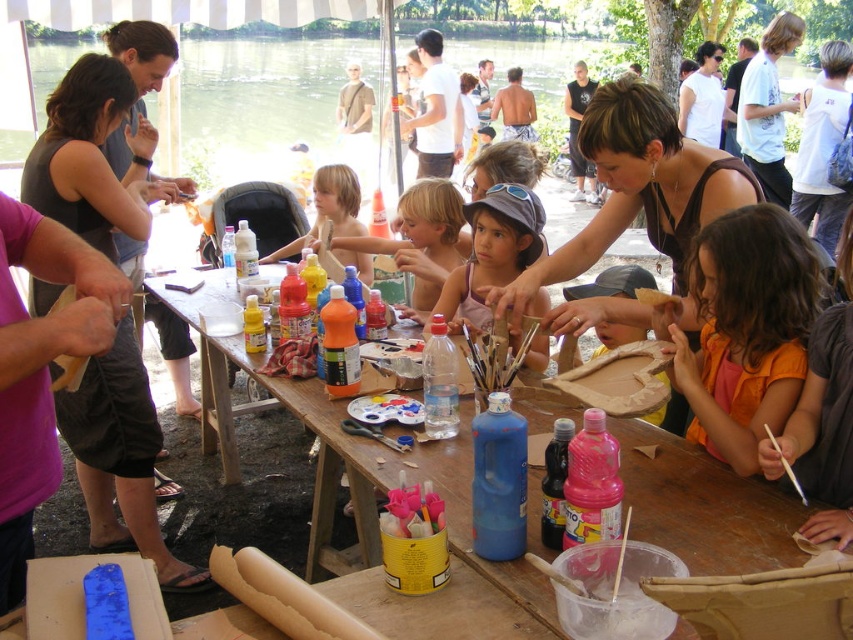
You are standing at the edge of the water and want to reach the wooden table at center to grab some paint. However, there is a person wearing a matte brown tank top at center blocking your path. According to the scene description, which direction should you move to go around them and reach the table?

Since the wooden table at center is to the left of the matte brown tank top at center, you should move to the left side of the person wearing the matte brown tank top at center to reach the wooden table at center.

You are a photographer trying to capture a candid shot of the pink fabric shirt at center and the blonde hair child at center. Based on their heights, which one should you focus on first to ensure both are in frame without needing to adjust your camera angle?

The pink fabric shirt at center has a lesser height compared to the blonde hair child at center, so you should focus on the blonde hair child at center first to ensure both are in frame without needing to adjust your camera angle.